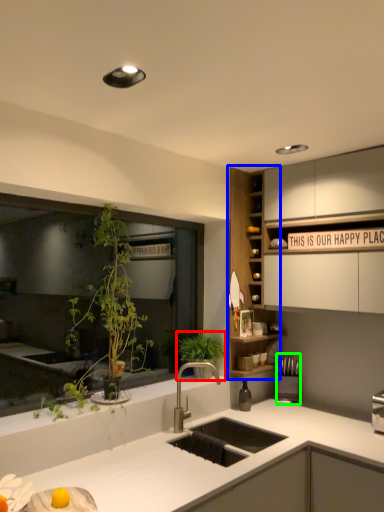
Question: Which object is positioned closest to vegetation (highlighted by a red box)? Select from cabinet (highlighted by a blue box) and appliance (highlighted by a green box).

Choices:
 (A) cabinet
 (B) appliance

Answer: (A)